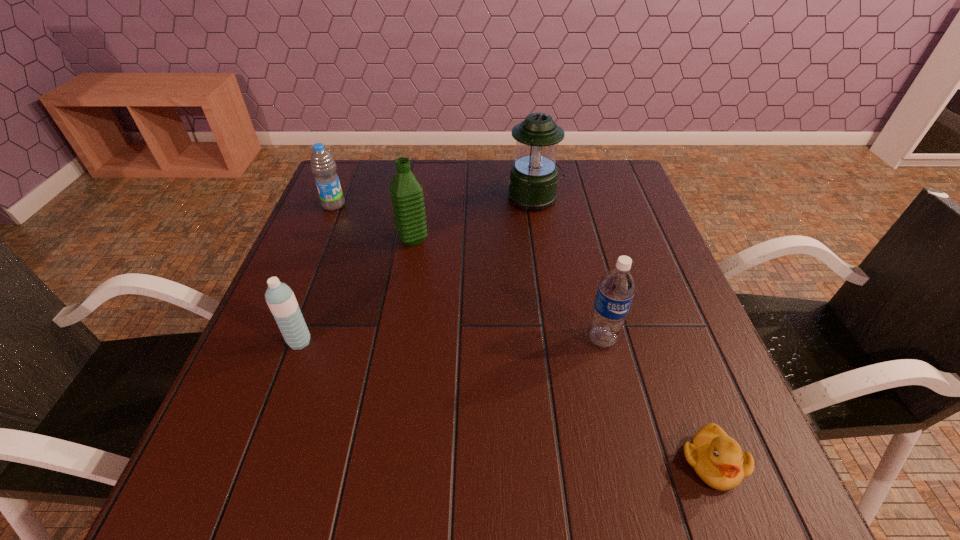
At what (x,y) coordinates should I click in order to perform the action: click on vacant area that lies between the rightmost water bottle and the shortest object. Please return your answer as a coordinate pair (x, y). The width and height of the screenshot is (960, 540). Looking at the image, I should click on (657, 401).

Locate an element on the screen. The width and height of the screenshot is (960, 540). object identified as the fifth closest to the rightmost water bottle is located at coordinates (323, 166).

Choose which object is the fourth nearest neighbor to the duckling. Please provide its 2D coordinates. Your answer should be formatted as a tuple, i.e. [(x, y)], where the tuple contains the x and y coordinates of a point satisfying the conditions above.

[(281, 300)]

This screenshot has height=540, width=960. In order to click on the second closest water bottle to the rightmost water bottle in this screenshot , I will do `click(281, 300)`.

You are a GUI agent. You are given a task and a screenshot of the screen. Output one action in this format:
    pyautogui.click(x=<x>, y=<y>)
    Task: Click on the second closest water bottle to the duckling
    
    Given the screenshot: What is the action you would take?
    pyautogui.click(x=407, y=194)